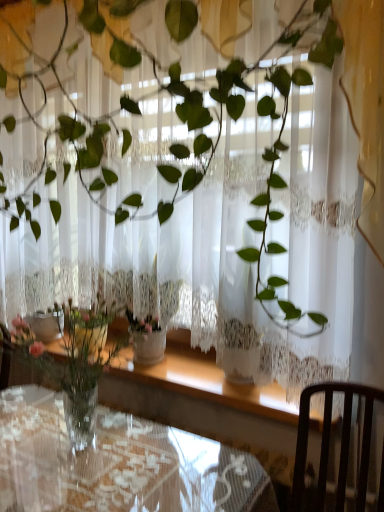
The height and width of the screenshot is (512, 384). Describe the element at coordinates (118, 464) in the screenshot. I see `clear glass table at center` at that location.

What is the approximate height of clear glass table at center?

clear glass table at center is 29.02 inches in height.

What is the approximate width of clear glass table at center?

clear glass table at center is 27.71 inches wide.

Image resolution: width=384 pixels, height=512 pixels. What are the coordinates of `clear glass table at center` in the screenshot? It's located at (118, 464).

Locate an element on the screen. This screenshot has height=512, width=384. dark wood chair at lower right is located at coordinates (329, 442).

What do you see at coordinates (329, 442) in the screenshot? I see `dark wood chair at lower right` at bounding box center [329, 442].

Measure the distance between dark wood chair at lower right and camera.

dark wood chair at lower right and camera are 4.50 feet apart.

Locate an element on the screen. Image resolution: width=384 pixels, height=512 pixels. clear glass table at center is located at coordinates (118, 464).

Is clear glass table at center to the left or to the right of dark wood chair at lower right in the image?

clear glass table at center is to the left of dark wood chair at lower right.

Is clear glass table at center closer to camera compared to dark wood chair at lower right?

No, the depth of clear glass table at center is greater than that of dark wood chair at lower right.

Considering the points (260, 471) and (331, 395), which point is behind, point (260, 471) or point (331, 395)?

The point (260, 471) is behind.

From the image's perspective, which one is positioned higher, clear glass table at center or dark wood chair at lower right?

From the image's view, dark wood chair at lower right is above.

From a real-world perspective, between clear glass table at center and dark wood chair at lower right, who is vertically higher?

From a 3D spatial view, dark wood chair at lower right is above.

Looking at their sizes, would you say clear glass table at center is wider or thinner than dark wood chair at lower right?

In the image, clear glass table at center appears to be wider than dark wood chair at lower right.

Who is taller, clear glass table at center or dark wood chair at lower right?

clear glass table at center.

Who is smaller, clear glass table at center or dark wood chair at lower right?

dark wood chair at lower right is smaller.

Would you say clear glass table at center contains dark wood chair at lower right?

No, clear glass table at center does not contain dark wood chair at lower right.

Would you say clear glass table at center is a long distance from dark wood chair at lower right?

No, clear glass table at center is not far away from dark wood chair at lower right.

Looking at this image, is clear glass table at center aimed at dark wood chair at lower right?

No, clear glass table at center is not turned towards dark wood chair at lower right.

Can you tell me how much clear glass table at center and dark wood chair at lower right differ in facing direction?

clear glass table at center and dark wood chair at lower right are facing 3.4 degrees away from each other.

How far apart are clear glass table at center and dark wood chair at lower right?

The distance of clear glass table at center from dark wood chair at lower right is 19.21 inches.

Image resolution: width=384 pixels, height=512 pixels. I want to click on table on the left side of dark wood chair at lower right, so click(118, 464).

Would you say dark wood chair at lower right is to the left or to the right of clear glass table at center in the picture?

From the image, it's evident that dark wood chair at lower right is to the right of clear glass table at center.

Which object is more forward, dark wood chair at lower right or clear glass table at center?

dark wood chair at lower right is more forward.

Which is behind, point (293, 487) or point (194, 443)?

Point (194, 443)

From the image's perspective, who appears lower, dark wood chair at lower right or clear glass table at center?

clear glass table at center is shown below in the image.

From a real-world perspective, does dark wood chair at lower right sit lower than clear glass table at center?

No, from a real-world perspective, dark wood chair at lower right is not beneath clear glass table at center.

Considering the sizes of dark wood chair at lower right and clear glass table at center in the image, is dark wood chair at lower right wider or thinner than clear glass table at center?

dark wood chair at lower right is thinner than clear glass table at center.

Who is shorter, dark wood chair at lower right or clear glass table at center?

Standing shorter between the two is dark wood chair at lower right.

Looking at this image, who is bigger, dark wood chair at lower right or clear glass table at center?

Bigger between the two is clear glass table at center.

Is dark wood chair at lower right located outside clear glass table at center?

Yes.

Are dark wood chair at lower right and clear glass table at center far apart?

dark wood chair at lower right is actually quite close to clear glass table at center.

From the picture: Is dark wood chair at lower right facing towards clear glass table at center?

No, dark wood chair at lower right is not facing towards clear glass table at center.

How much distance is there between dark wood chair at lower right and clear glass table at center?

19.21 inches.

In the image, there is a clear glass table at center. Identify the location of chair above it (from the image's perspective). (329, 442).

I want to click on chair that appears above the clear glass table at center (from a real-world perspective), so click(x=329, y=442).

This screenshot has width=384, height=512. I want to click on table below the dark wood chair at lower right (from the image's perspective), so click(x=118, y=464).